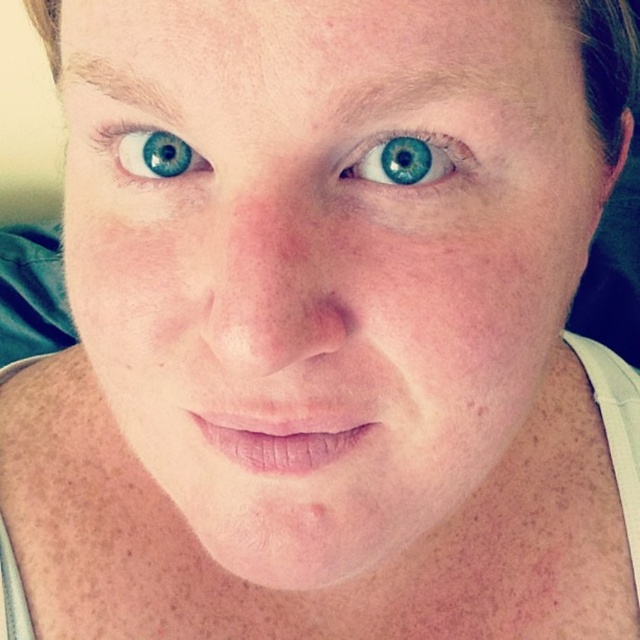
Can you confirm if blue glossy eye at upper center is positioned below blue glossy eye at upper left?

Correct, blue glossy eye at upper center is located below blue glossy eye at upper left.

Is point (413, 170) less distant than point (116, 150)?

Yes, it is in front of point (116, 150).

Image resolution: width=640 pixels, height=640 pixels. Describe the element at coordinates (410, 161) in the screenshot. I see `blue glossy eye at upper center` at that location.

This screenshot has width=640, height=640. Identify the location of blue glossy eye at upper center. coord(410,161).